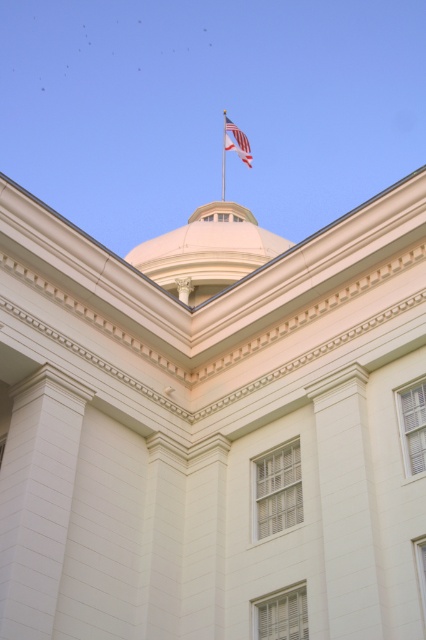
Question: Which object is closer to the camera taking this photo?

Choices:
 (A) american flag at upper center
 (B) white smooth dome at center
 (C) metallic flag pole at upper center

Answer: (B)

Question: Which point is farther to the camera?

Choices:
 (A) (224, 124)
 (B) (158, 244)
 (C) (239, 141)

Answer: (A)

Question: Can you confirm if white smooth dome at center is bigger than american flag at upper center?

Choices:
 (A) no
 (B) yes

Answer: (B)

Question: Is white smooth dome at center thinner than american flag at upper center?

Choices:
 (A) no
 (B) yes

Answer: (A)

Question: Which point is farther from the camera taking this photo?

Choices:
 (A) (154, 260)
 (B) (250, 161)

Answer: (B)

Question: Does white smooth dome at center lie behind metallic flag pole at upper center?

Choices:
 (A) no
 (B) yes

Answer: (A)